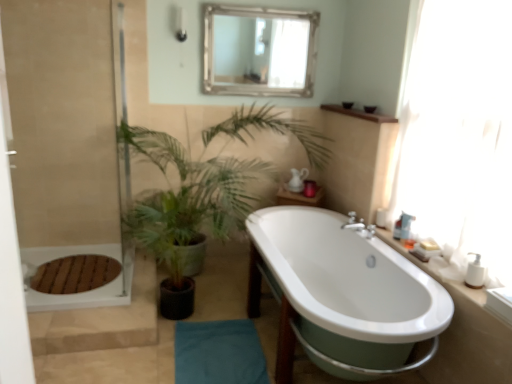
This screenshot has height=384, width=512. Find the location of `free space to the left of beige textured screen door at left`. free space to the left of beige textured screen door at left is located at coordinates (56, 288).